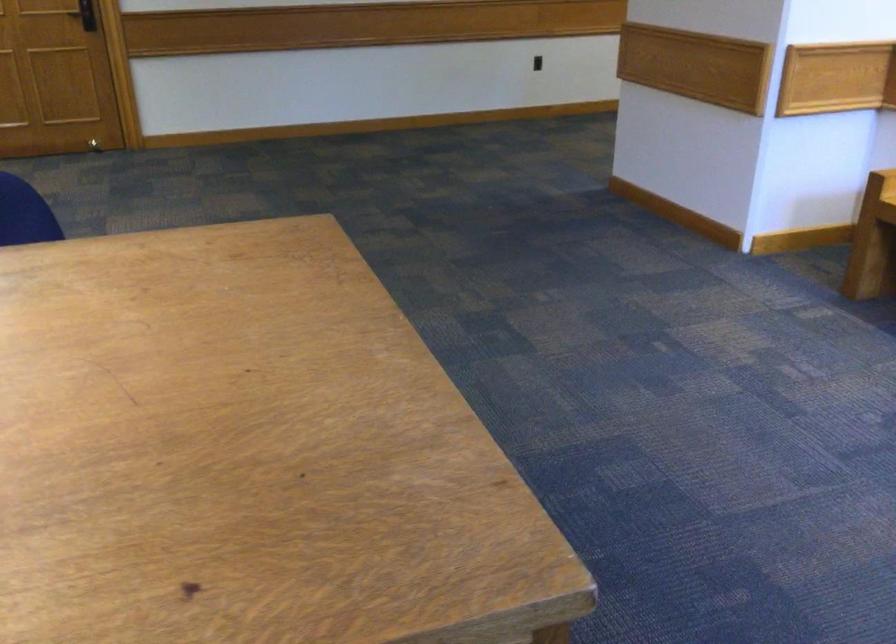
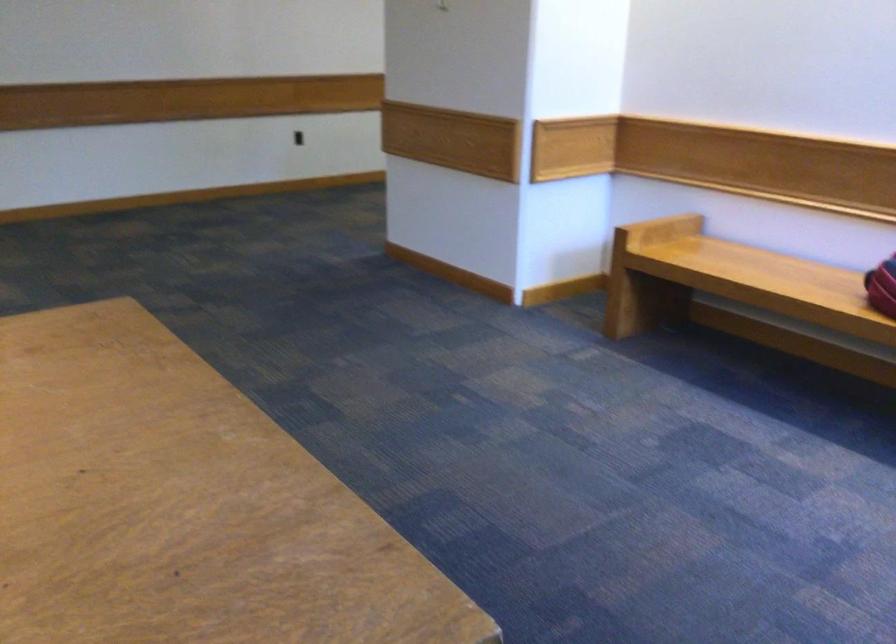
Question: Based on the continuous images, in which direction is the camera rotating? Reply with the corresponding letter.

Choices:
 (A) Left
 (B) Right
 (C) Up
 (D) Down

Answer: (B)